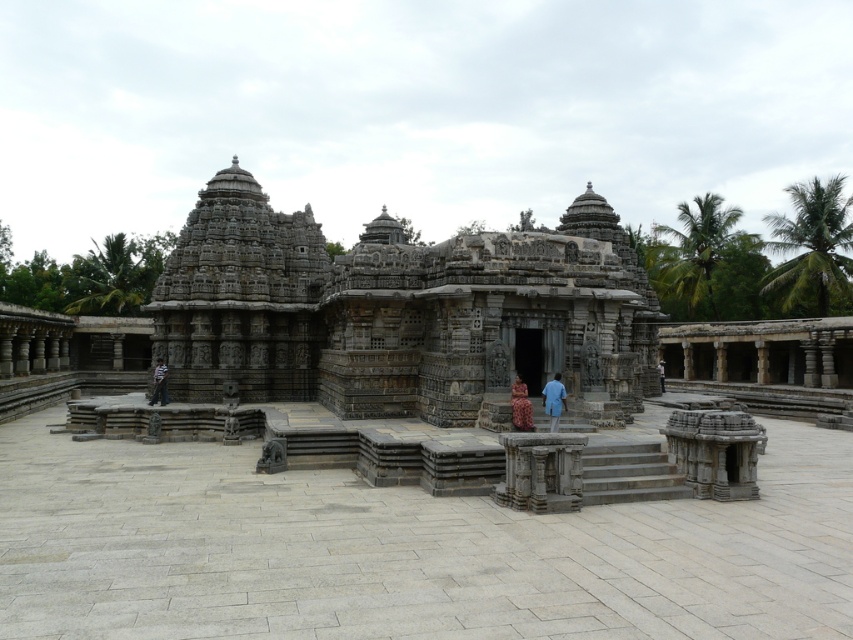
Does matte brown dress at center have a lesser height compared to light blue fabric at center?

Correct, matte brown dress at center is not as tall as light blue fabric at center.

Does point (523, 419) come farther from viewer compared to point (659, 372)?

No.

Is point (514, 381) farther from viewer compared to point (659, 369)?

No, (514, 381) is in front of (659, 369).

Identify the location of matte brown dress at center. This screenshot has width=853, height=640. (520, 406).

Can you confirm if gray stone hindu temple at center is positioned below blue cotton shirt at center?

No, gray stone hindu temple at center is not below blue cotton shirt at center.

Does gray stone hindu temple at center appear on the left side of blue cotton shirt at center?

Correct, you'll find gray stone hindu temple at center to the left of blue cotton shirt at center.

This screenshot has width=853, height=640. I want to click on gray stone hindu temple at center, so click(399, 310).

At what (x,y) coordinates should I click in order to perform the action: click on gray stone hindu temple at center. Please return your answer as a coordinate pair (x, y). The image size is (853, 640). Looking at the image, I should click on (399, 310).

Which is above, blue cotton shirt at center or light blue fabric at center?

blue cotton shirt at center

Is point (566, 396) farther from viewer compared to point (659, 378)?

No.

Where is `blue cotton shirt at center`? The height and width of the screenshot is (640, 853). blue cotton shirt at center is located at coordinates (554, 401).